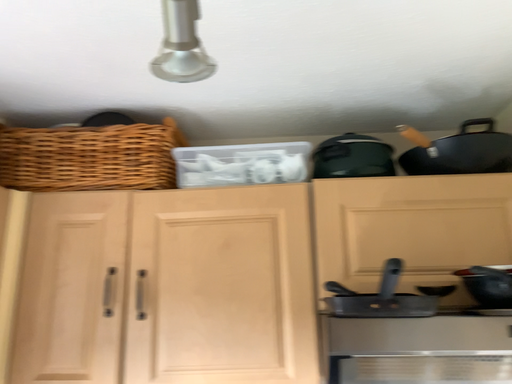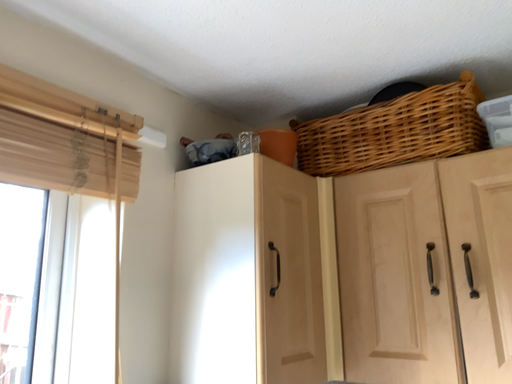
Question: Which way did the camera rotate in the video?

Choices:
 (A) rotated right
 (B) rotated left

Answer: (B)